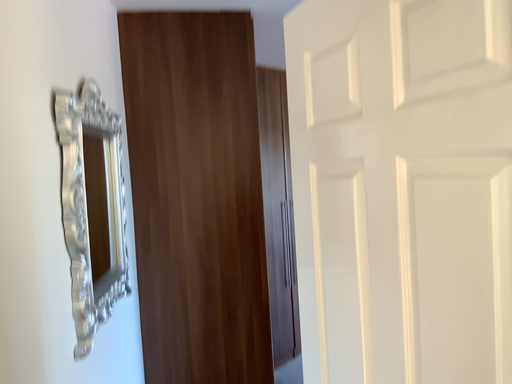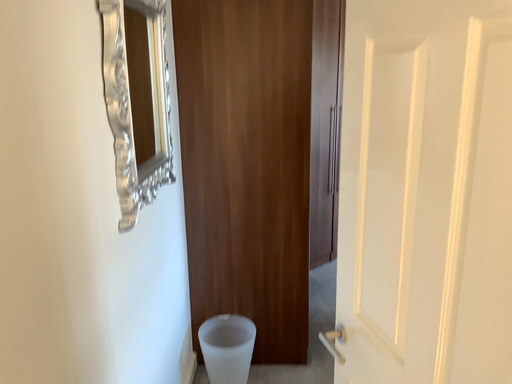
Question: Which way did the camera rotate in the video?

Choices:
 (A) rotated right
 (B) rotated left

Answer: (B)